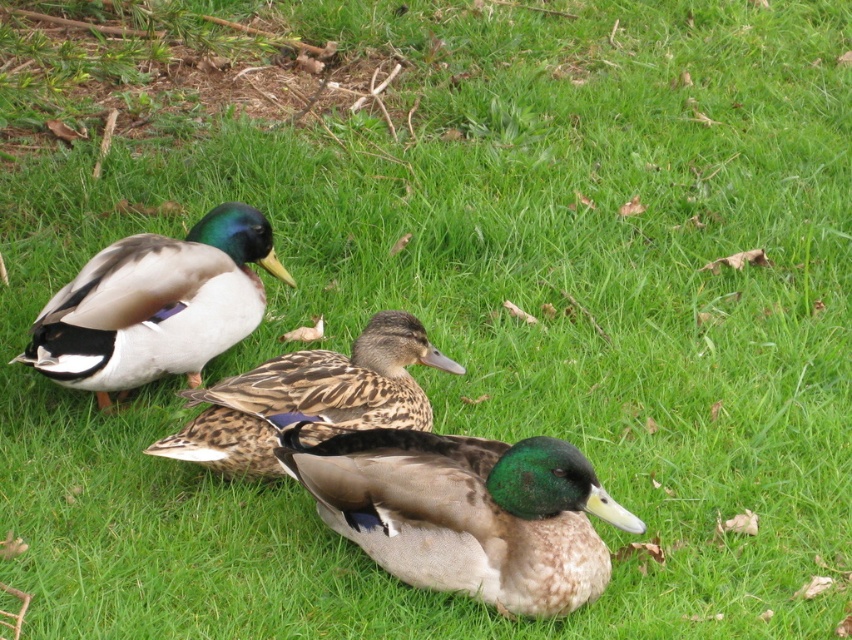
Does point (557, 545) come closer to viewer compared to point (240, 316)?

Yes, point (557, 545) is in front of point (240, 316).

Is point (401, 461) more distant than point (203, 216)?

No, (401, 461) is closer to viewer.

Does point (482, 472) lie behind point (98, 404)?

No, it is in front of (98, 404).

Where is `green glossy duck at center`? This screenshot has width=852, height=640. green glossy duck at center is located at coordinates (465, 513).

Can you confirm if shiny green drake at upper left is positioned to the right of brown speckled duck at center?

No, shiny green drake at upper left is not to the right of brown speckled duck at center.

Does shiny green drake at upper left lie in front of brown speckled duck at center?

No, it is not.

Which is behind, point (99, 260) or point (398, 349)?

The point (99, 260) is behind.

You are a GUI agent. You are given a task and a screenshot of the screen. Output one action in this format:
    pyautogui.click(x=<x>, y=<y>)
    Task: Click on the shiny green drake at upper left
    Image resolution: width=852 pixels, height=640 pixels.
    Given the screenshot: What is the action you would take?
    pyautogui.click(x=156, y=305)

Can you confirm if green glossy duck at center is positioned above brown speckled duck at center?

Incorrect, green glossy duck at center is not positioned above brown speckled duck at center.

Which is more to the right, green glossy duck at center or brown speckled duck at center?

green glossy duck at center is more to the right.

Between point (332, 456) and point (240, 435), which one is positioned in front?

Point (332, 456) is in front.

The image size is (852, 640). What are the coordinates of `green glossy duck at center` in the screenshot? It's located at (465, 513).